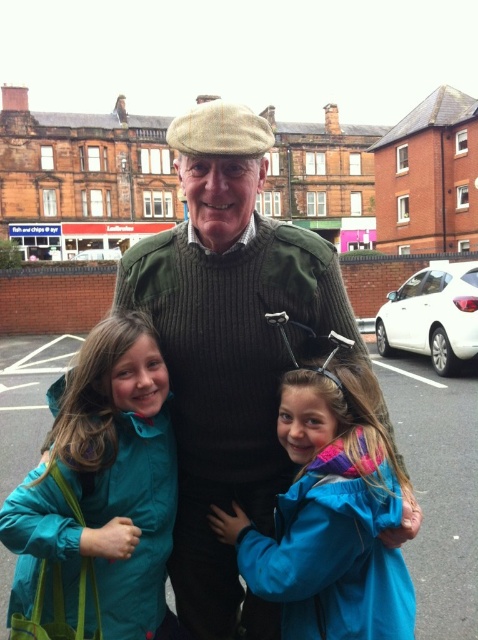
Question: Which point is closer to the camera?

Choices:
 (A) (205, 152)
 (B) (335, 472)

Answer: (B)

Question: Can you confirm if green wool sweater at center is smaller than blue fabric jacket at center?

Choices:
 (A) yes
 (B) no

Answer: (B)

Question: Which point is farther to the camera?

Choices:
 (A) blue fabric jacket at center
 (B) green wool sweater at center
 (C) teal fabric jacket at lower left

Answer: (B)

Question: Does teal fabric jacket at lower left appear over blue fabric jacket at center?

Choices:
 (A) yes
 (B) no

Answer: (A)

Question: Considering the real-world distances, which object is closest to the teal fabric jacket at lower left?

Choices:
 (A) green wool sweater at center
 (B) blue fabric jacket at center

Answer: (A)

Question: Observing the image, what is the correct spatial positioning of teal fabric jacket at lower left in reference to blue fabric jacket at center?

Choices:
 (A) below
 (B) above

Answer: (B)